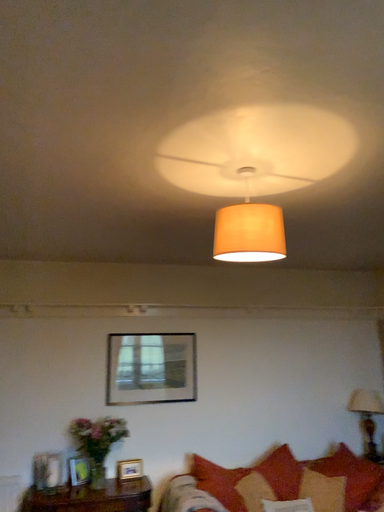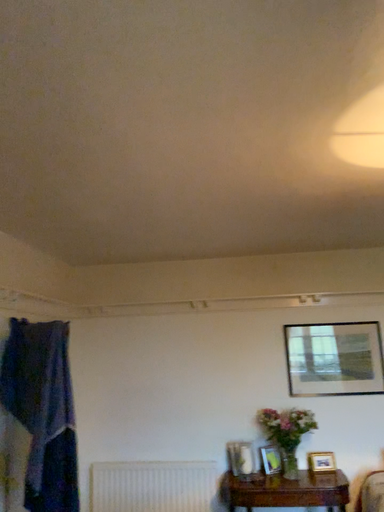
Question: How did the camera likely rotate when shooting the video?

Choices:
 (A) rotated left
 (B) rotated right

Answer: (A)